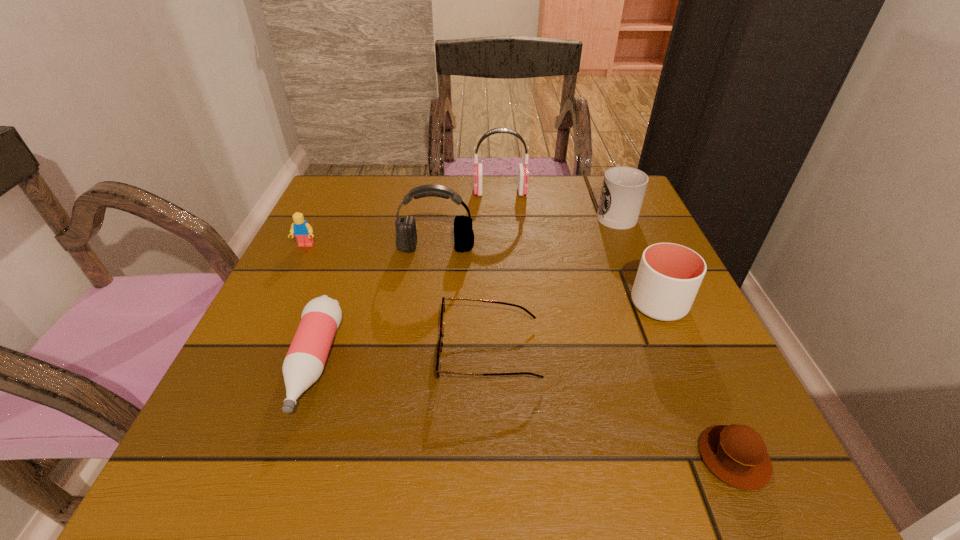
The image size is (960, 540). What are the coordinates of `blank space located on the outer surface of the earphone` in the screenshot? It's located at (406, 192).

This screenshot has height=540, width=960. In order to click on free space located on the outer surface of the earphone in this screenshot , I will do `click(361, 192)`.

Image resolution: width=960 pixels, height=540 pixels. Identify the location of vacant area located on the headband of the headset. (429, 306).

Locate an element on the screen. The image size is (960, 540). free space located on the front of the nearer cup is located at coordinates (698, 395).

The height and width of the screenshot is (540, 960). Identify the location of vacant space located 0.380m on the front-facing side of the Lego. (231, 397).

Find the location of a particular element. vacant space positioned 0.060m with the cap open on the second object from left to right is located at coordinates (278, 464).

The image size is (960, 540). What are the coordinates of `vacant region located on the face of the spectacles` in the screenshot? It's located at (284, 352).

Find the location of a particular element. vacant space located on the face of the spectacles is located at coordinates point(255,352).

Where is `free space located 0.140m on the face of the spectacles`? The image size is (960, 540). free space located 0.140m on the face of the spectacles is located at coordinates (360, 352).

Where is `free location located on the back of the nearest object`? Image resolution: width=960 pixels, height=540 pixels. free location located on the back of the nearest object is located at coordinates (648, 268).